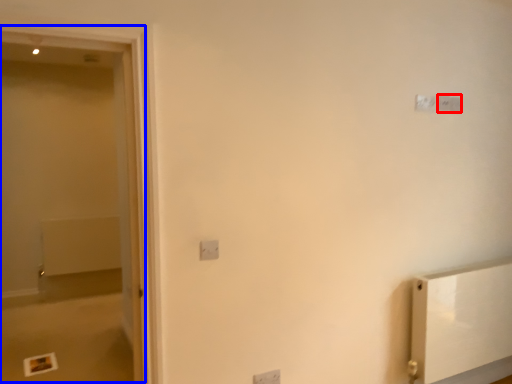
Question: Which point is closer to the camera, light switch (highlighted by a red box) or screen door (highlighted by a blue box)?

Choices:
 (A) light switch
 (B) screen door

Answer: (B)